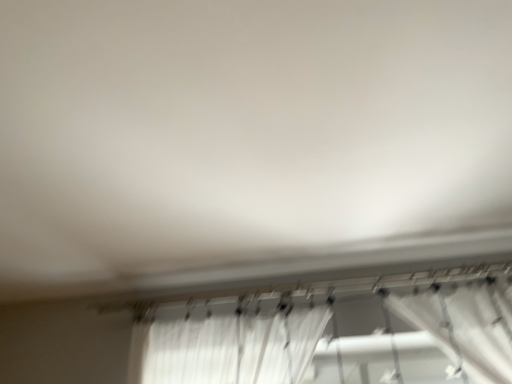
You are a GUI agent. You are given a task and a screenshot of the screen. Output one action in this format:
    pyautogui.click(x=<x>, y=<y>)
    Task: Click on the white sheer curtain at right
    
    Given the screenshot: What is the action you would take?
    pyautogui.click(x=465, y=326)

This screenshot has height=384, width=512. What do you see at coordinates (465, 326) in the screenshot?
I see `white sheer curtain at right` at bounding box center [465, 326].

Where is `white sheer curtain at right`? white sheer curtain at right is located at coordinates (465, 326).